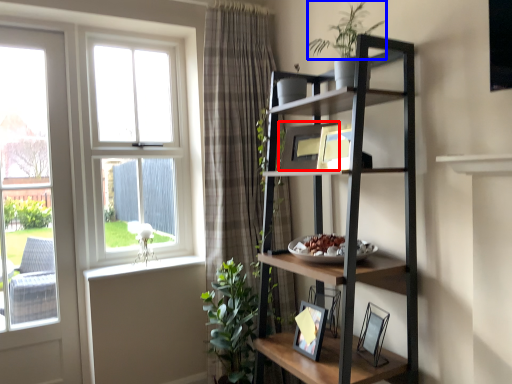
Question: Which object appears closest to the camera in this image, picture frame (highlighted by a red box) or vegetation (highlighted by a blue box)?

Choices:
 (A) picture frame
 (B) vegetation

Answer: (B)